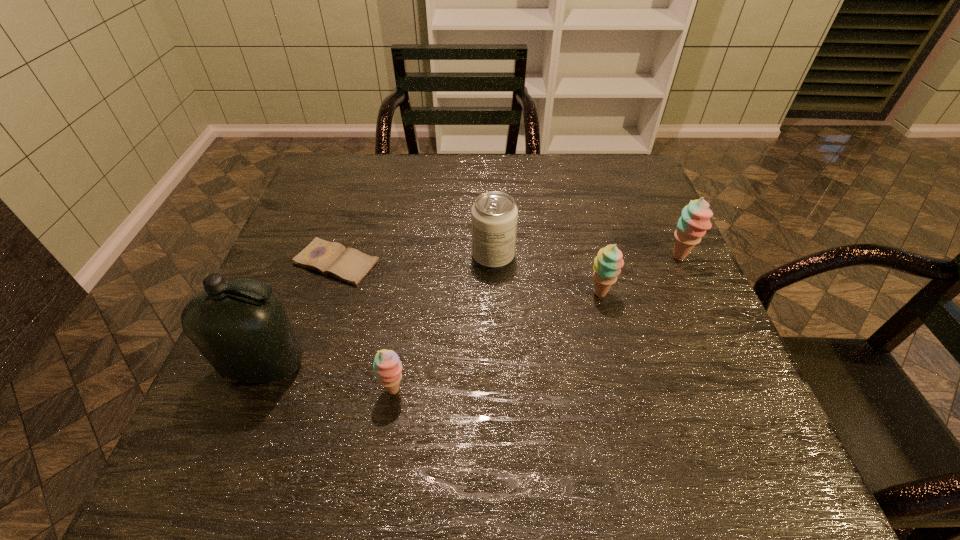
Identify the location of free point located on the left of the fifth object from left to right. pos(459,294).

Locate an element on the screen. This screenshot has width=960, height=540. vacant space located 0.060m on the left of the farthest sherbert is located at coordinates (640, 257).

Where is `blank space located 0.400m on the back of the diary`? blank space located 0.400m on the back of the diary is located at coordinates (372, 156).

This screenshot has width=960, height=540. In order to click on free region located 0.090m on the left of the soda can in this screenshot , I will do `click(434, 256)`.

What are the coordinates of `vacant area located on the back of the tallest object` in the screenshot? It's located at (285, 317).

The image size is (960, 540). I want to click on sherbert that is at the near edge, so click(388, 368).

Where is `bottle at the near edge`? The image size is (960, 540). bottle at the near edge is located at coordinates (240, 326).

This screenshot has width=960, height=540. In order to click on diary situated at the left edge in this screenshot , I will do `click(350, 265)`.

This screenshot has width=960, height=540. Find the location of `bottle at the left edge`. bottle at the left edge is located at coordinates pyautogui.click(x=240, y=326).

This screenshot has height=540, width=960. What are the coordinates of `object that is at the right edge` in the screenshot? It's located at (695, 218).